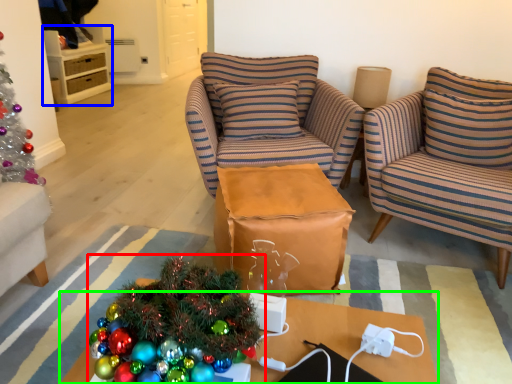
Question: Which is farther away from christmas tree (highlighted by a red box)? cabinetry (highlighted by a blue box) or desk (highlighted by a green box)?

Choices:
 (A) cabinetry
 (B) desk

Answer: (A)